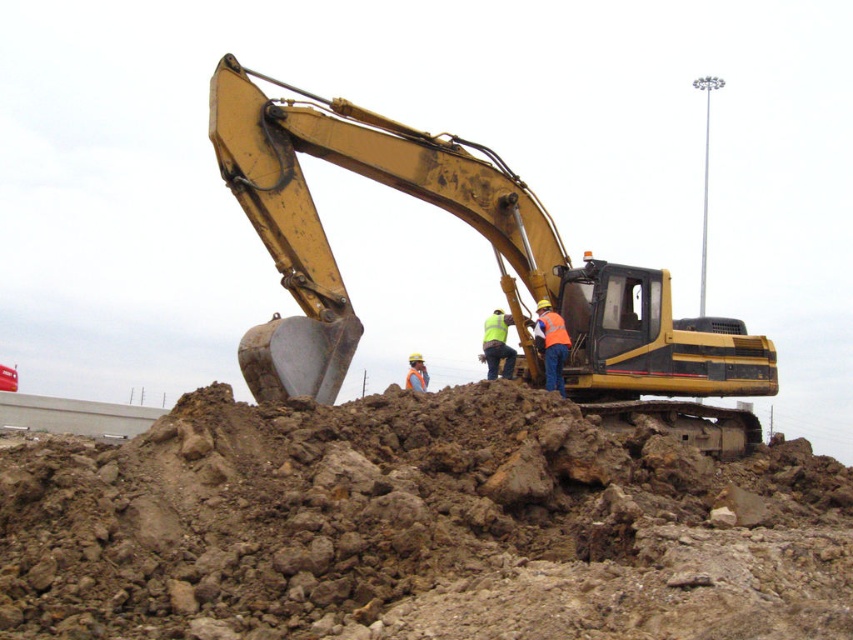
You are a safety inspector at the construction site. You notice the brown rocky dirt at center and the yellow metallic excavator at center. Based on their positions, is there a risk of the excavator accidentally tipping over onto the dirt? Please explain your reasoning.

The brown rocky dirt at center is located below the yellow metallic excavator at center. Since the dirt is positioned beneath the excavator, there is a risk of the excavator tipping over onto the dirt if it shifts its weight or the ground beneath it becomes unstable.

You are standing at the construction site and want to reach the point marked as point (822, 476). If you can walk at a speed of 3 feet per second, how long will it take you to reach that point?

The point (822, 476) is 65.32 feet away from the viewer. At a walking speed of 3 feet per second, it would take approximately 21.77 seconds to reach the point.